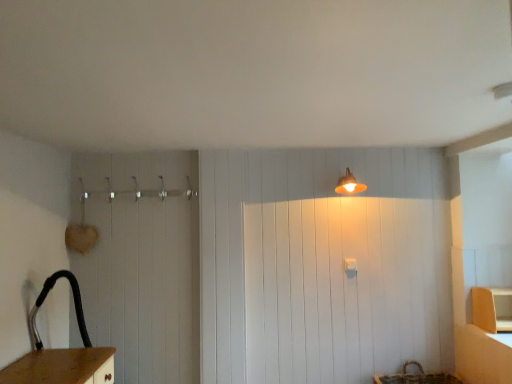
Question: In the image, is matte wood cabinet at lower right positioned in front of or behind matte orange lampshade at upper center?

Choices:
 (A) behind
 (B) front

Answer: (B)

Question: Based on their sizes in the image, would you say matte wood cabinet at lower right is bigger or smaller than matte orange lampshade at upper center?

Choices:
 (A) small
 (B) big

Answer: (B)

Question: Is matte wood cabinet at lower right inside the boundaries of matte orange lampshade at upper center, or outside?

Choices:
 (A) outside
 (B) inside

Answer: (A)

Question: Is matte orange lampshade at upper center to the left or to the right of matte wood cabinet at lower right in the image?

Choices:
 (A) left
 (B) right

Answer: (A)

Question: Do you think matte orange lampshade at upper center is within matte wood cabinet at lower right, or outside of it?

Choices:
 (A) inside
 (B) outside

Answer: (B)

Question: From a real-world perspective, relative to matte wood cabinet at lower right, is matte orange lampshade at upper center vertically above or below?

Choices:
 (A) below
 (B) above

Answer: (B)

Question: Considering their positions, is matte orange lampshade at upper center located in front of or behind matte wood cabinet at lower right?

Choices:
 (A) front
 (B) behind

Answer: (B)